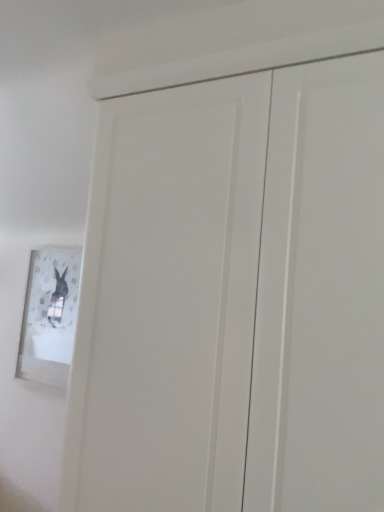
What is the approximate width of matte glass picture frame at upper left?

The width of matte glass picture frame at upper left is 2.30 inches.

Find the location of a particular element. The height and width of the screenshot is (512, 384). matte glass picture frame at upper left is located at coordinates (49, 316).

What do you see at coordinates (49, 316) in the screenshot? This screenshot has width=384, height=512. I see `matte glass picture frame at upper left` at bounding box center [49, 316].

Where is `matte glass picture frame at upper left`? matte glass picture frame at upper left is located at coordinates (49, 316).